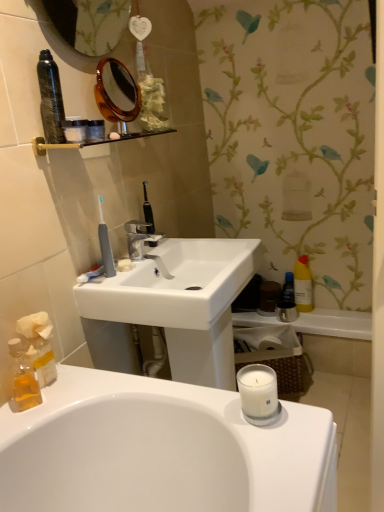
Question: Does white matte soap at center touch metallic silver bath at lower right?

Choices:
 (A) yes
 (B) no

Answer: (B)

Question: From a real-world perspective, is white matte soap at center located higher than metallic silver bath at lower right?

Choices:
 (A) yes
 (B) no

Answer: (A)

Question: Does white matte soap at center lie in front of metallic silver bath at lower right?

Choices:
 (A) no
 (B) yes

Answer: (B)

Question: From the image's perspective, is white matte soap at center below metallic silver bath at lower right?

Choices:
 (A) yes
 (B) no

Answer: (B)

Question: Does white matte soap at center have a greater height compared to metallic silver bath at lower right?

Choices:
 (A) yes
 (B) no

Answer: (B)

Question: From the image's perspective, would you say white matte soap at center is positioned over metallic silver bath at lower right?

Choices:
 (A) no
 (B) yes

Answer: (B)

Question: Does matte silver faucet at center have a greater height compared to yellow matte bottle at right?

Choices:
 (A) no
 (B) yes

Answer: (A)

Question: Can you confirm if matte silver faucet at center is smaller than yellow matte bottle at right?

Choices:
 (A) no
 (B) yes

Answer: (B)

Question: Can you confirm if matte silver faucet at center is thinner than yellow matte bottle at right?

Choices:
 (A) yes
 (B) no

Answer: (B)

Question: From a real-world perspective, is matte silver faucet at center beneath yellow matte bottle at right?

Choices:
 (A) no
 (B) yes

Answer: (A)

Question: Is matte silver faucet at center positioned far away from yellow matte bottle at right?

Choices:
 (A) yes
 (B) no

Answer: (B)

Question: Is matte silver faucet at center aimed at yellow matte bottle at right?

Choices:
 (A) yes
 (B) no

Answer: (B)

Question: Is white paper tissue at lower left thinner than metallic silver bath at lower right?

Choices:
 (A) no
 (B) yes

Answer: (B)